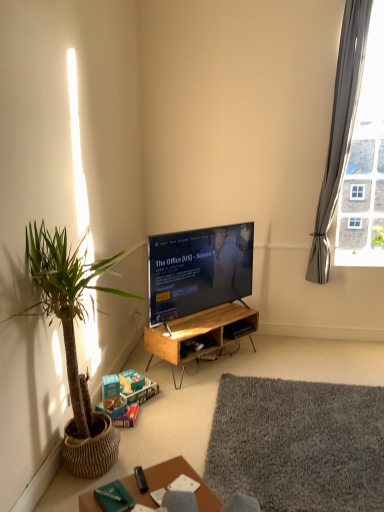
In order to click on vacant location below gray fabric curtain at upper right (from a real-world perspective) in this screenshot , I will do `click(324, 339)`.